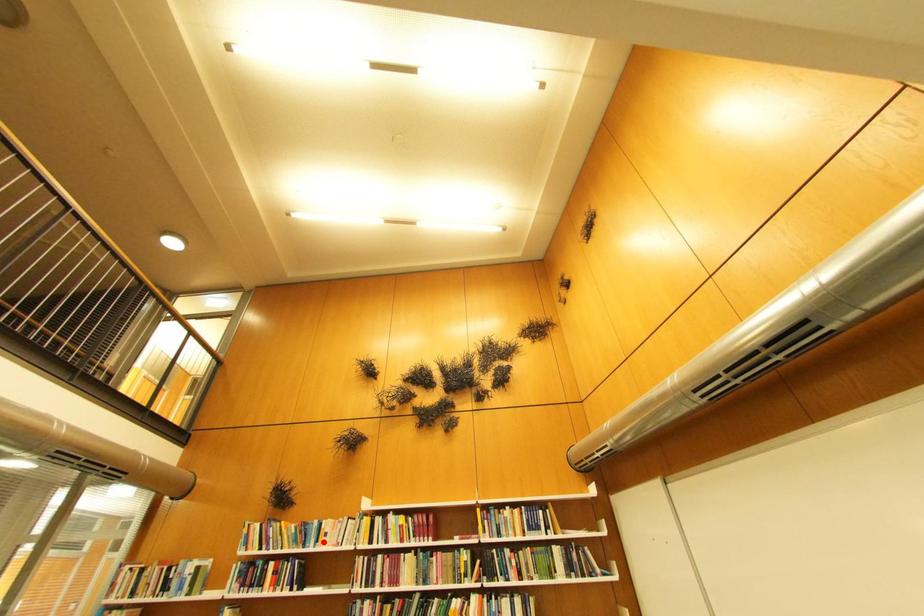
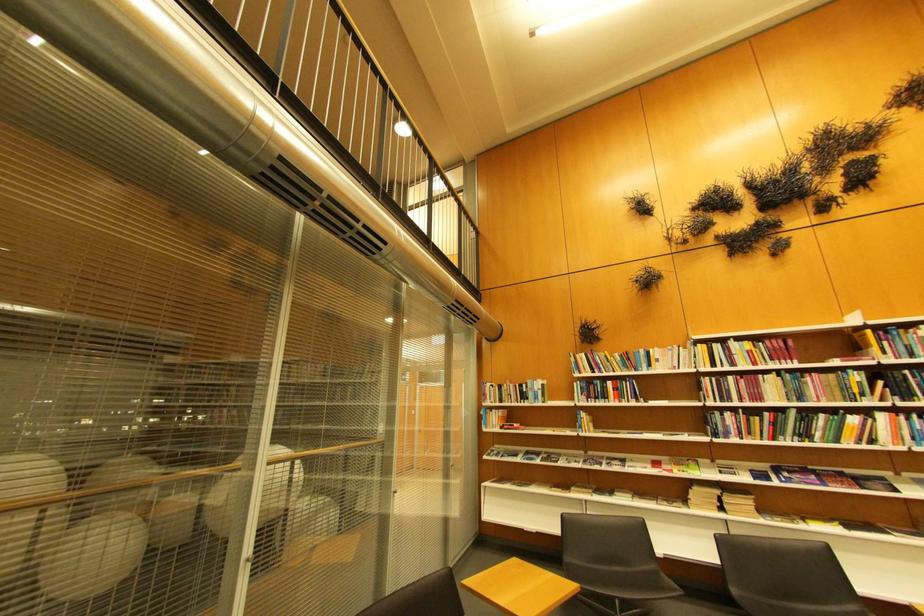
Locate, in the second image, the point that corresponds to the highlighted location in the first image.

(654, 368)